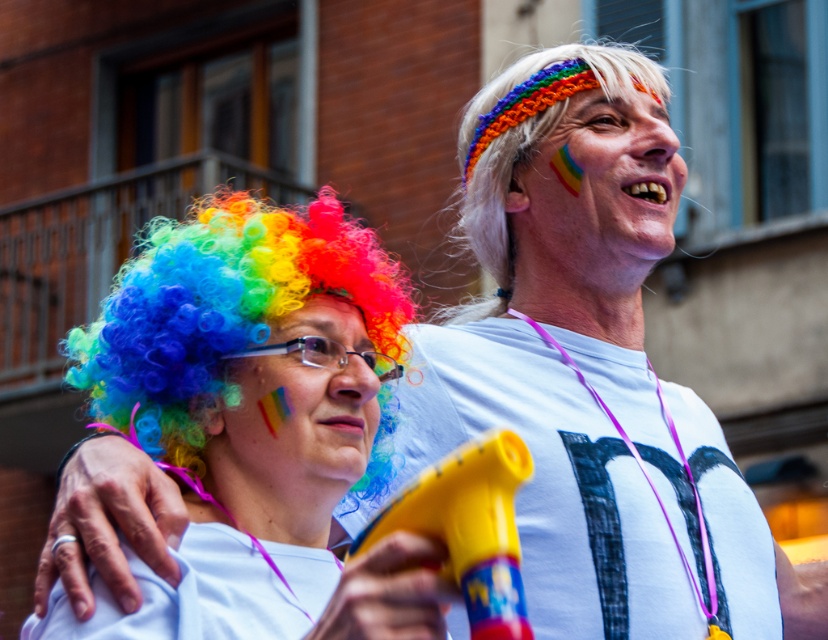
Question: Is rainbow wig at left smaller than white knitted headband at upper right?

Choices:
 (A) yes
 (B) no

Answer: (B)

Question: Does rainbow fabric headband at upper center appear on the right side of rainbow wig at center?

Choices:
 (A) no
 (B) yes

Answer: (B)

Question: Based on their relative distances, which object is nearer to the rainbow fabric headband at upper center?

Choices:
 (A) rainbow wig at center
 (B) white knitted headband at upper right
 (C) rainbow wig at left

Answer: (B)

Question: Is rainbow wig at left above rainbow wig at center?

Choices:
 (A) yes
 (B) no

Answer: (B)

Question: Which object appears farthest from the camera in this image?

Choices:
 (A) rainbow wig at left
 (B) rainbow wig at center

Answer: (B)

Question: Based on their relative distances, which object is farther from the rainbow wig at center?

Choices:
 (A) white knitted headband at upper right
 (B) rainbow fabric headband at upper center
 (C) rainbow wig at left

Answer: (A)